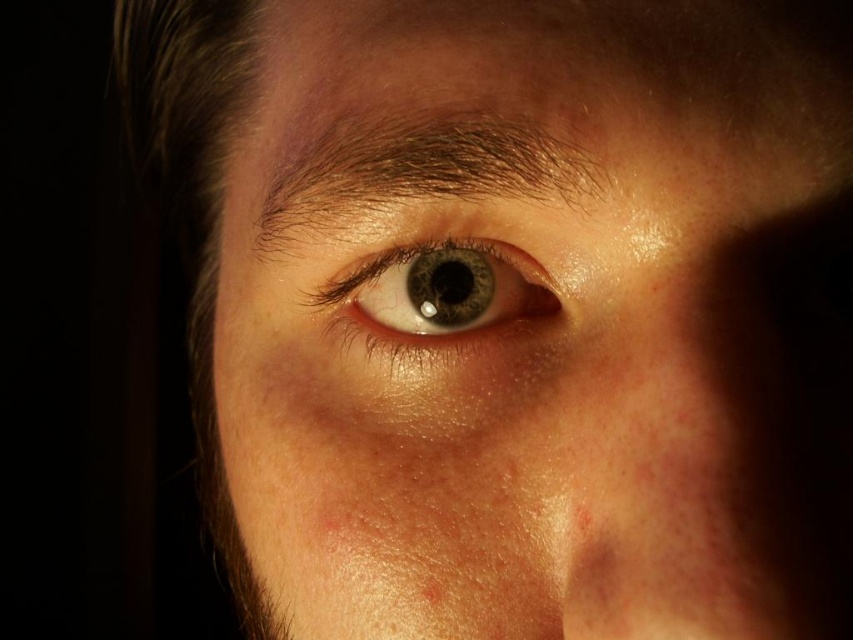
Who is more forward, (289, 262) or (431, 605)?

Positioned in front is point (431, 605).

Which of these two, smooth skin eye at center or brown matte freckle at lower center, stands shorter?

brown matte freckle at lower center is shorter.

Locate an element on the screen. smooth skin eye at center is located at coordinates pyautogui.click(x=537, y=321).

In the scene shown: Does smooth skin eye at center appear under shiny blue eye at center?

Yes.

Which is in front, point (659, 515) or point (508, 312)?

Point (659, 515) is more forward.

Where is `smooth skin eye at center`? The height and width of the screenshot is (640, 853). smooth skin eye at center is located at coordinates (537, 321).

In the scene shown: Between shiny blue eye at center and brown matte freckle at lower center, which one is positioned lower?

Positioned lower is brown matte freckle at lower center.

The width and height of the screenshot is (853, 640). Describe the element at coordinates (445, 294) in the screenshot. I see `shiny blue eye at center` at that location.

In order to click on shiny blue eye at center in this screenshot , I will do `click(445, 294)`.